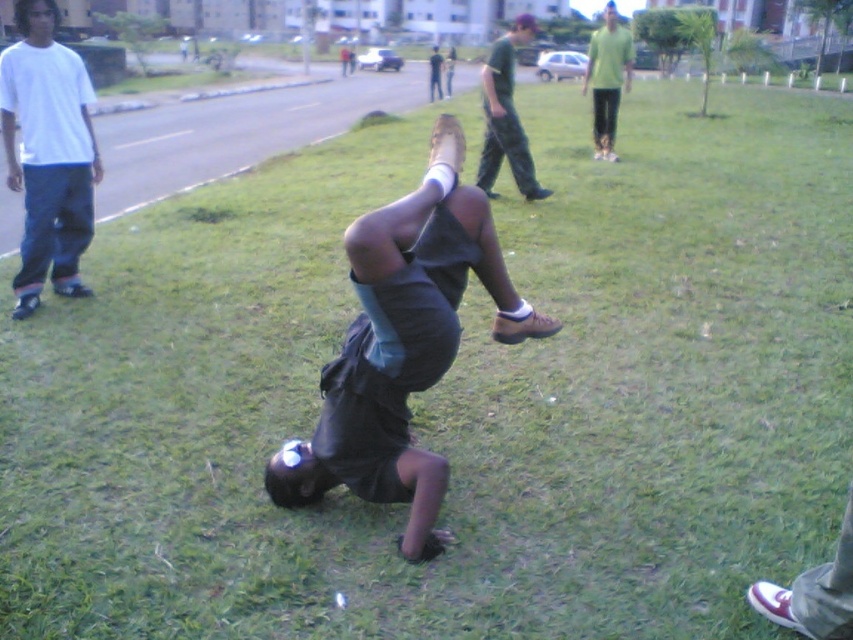
You are a photographer standing at the edge of the grassy area. You want to take a photo that includes both the dark gray fabric squat at center and the white cotton shirt at left. The minimum distance between the two subjects in the photo should be at least 10 feet. Can you position yourself in a way that meets this requirement?

The distance between the dark gray fabric squat at center and the white cotton shirt at left is 10.95 feet, which is more than the required 10 feet. Therefore, positioning yourself appropriately should allow you to capture both subjects with the desired separation.

You are standing at the edge of the grassy area and want to greet both the person in the white cotton shirt at left and the dark gray shirt at center. Which person should you approach first to reach them more quickly?

You should approach the white cotton shirt at left first because they are closer to you than the dark gray shirt at center, so you can reach them more quickly.

You are standing at the point marked as point (405,342) in the image. Looking around, you see dark gray fabric squat at center. What is directly under your feet?

The point marked as point (405,342) is directly under your feet, which marks the location of the dark gray fabric squat at center.